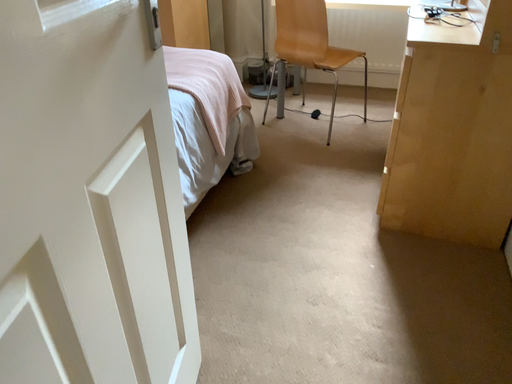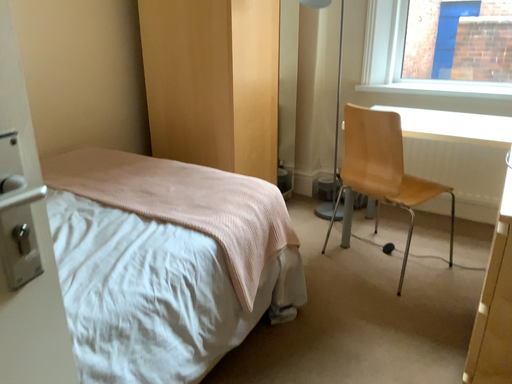
Question: How did the camera likely rotate when shooting the video?

Choices:
 (A) rotated right
 (B) rotated left

Answer: (B)